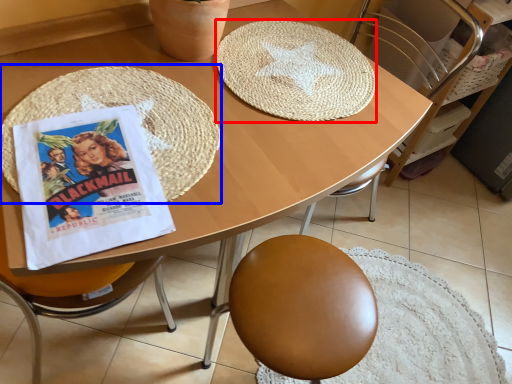
Question: Which of the following is the closest to the observer, mat (highlighted by a red box) or mat (highlighted by a blue box)?

Choices:
 (A) mat
 (B) mat

Answer: (B)